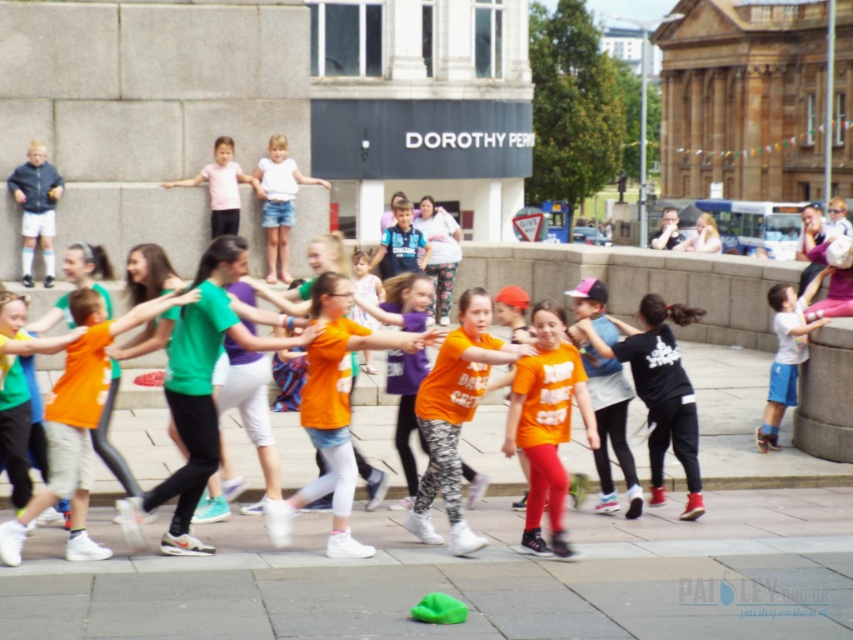
Question: Estimate the real-world distances between objects in this image. Which object is farther from the black matte shirt at center?

Choices:
 (A) orange cotton shirt at center
 (B) white cotton shirt at upper center

Answer: (B)

Question: Which of these objects is positioned closest to the matte black jacket at left?

Choices:
 (A) orange matte shirt at center
 (B) green fabric at lower center

Answer: (B)

Question: Can you confirm if black matte shirt at center is smaller than white cotton shirt at center?

Choices:
 (A) no
 (B) yes

Answer: (A)

Question: Is green fabric at lower center smaller than orange matte shirt at center?

Choices:
 (A) no
 (B) yes

Answer: (B)

Question: Among these points, which one is nearest to the camera?

Choices:
 (A) (224, 161)
 (B) (25, 196)
 (C) (184, 564)

Answer: (C)

Question: Is orange matte shirt at center positioned in front of pink fabric shirt at upper center?

Choices:
 (A) yes
 (B) no

Answer: (A)